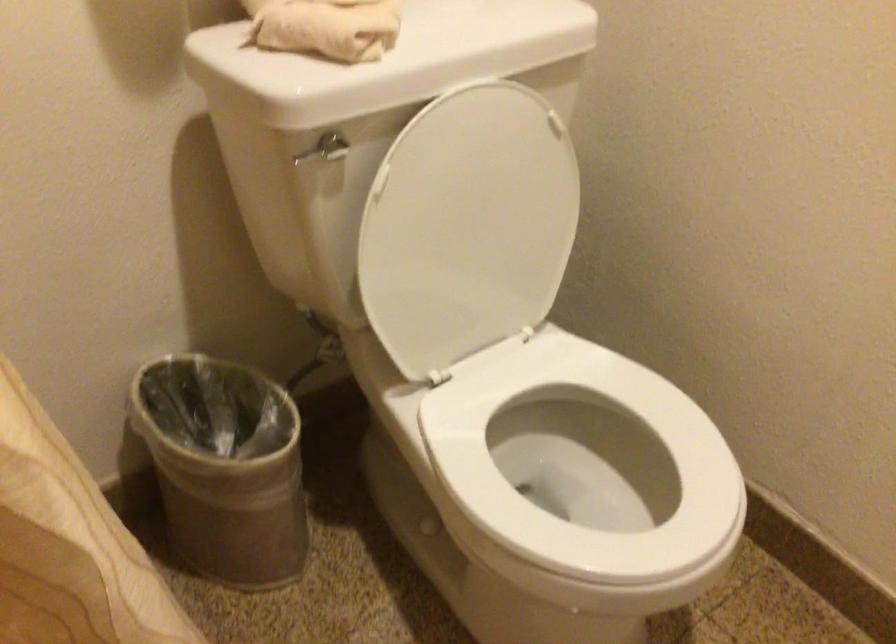
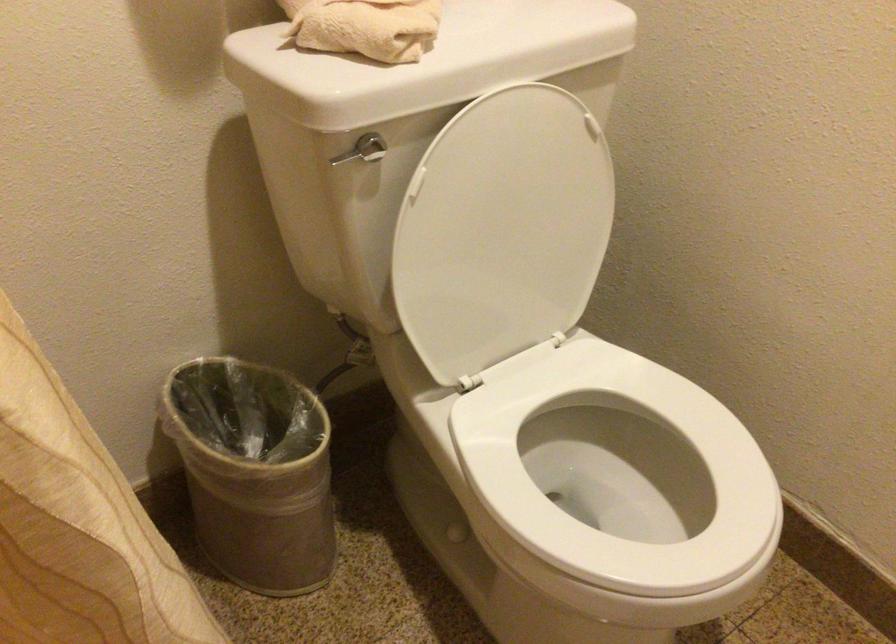
Where in the second image is the point corresponding to point (468, 225) from the first image?

(502, 230)